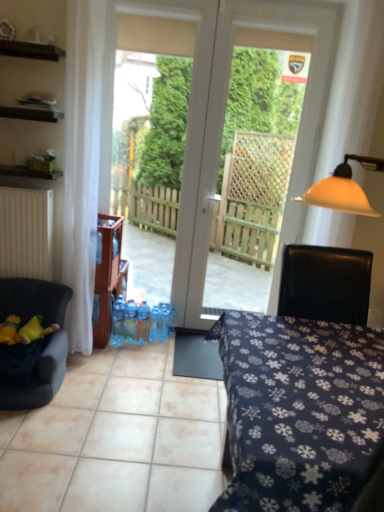
Where is `vacant region above dark blue fabric table at center (from a real-world perspective)`? vacant region above dark blue fabric table at center (from a real-world perspective) is located at coordinates (306, 357).